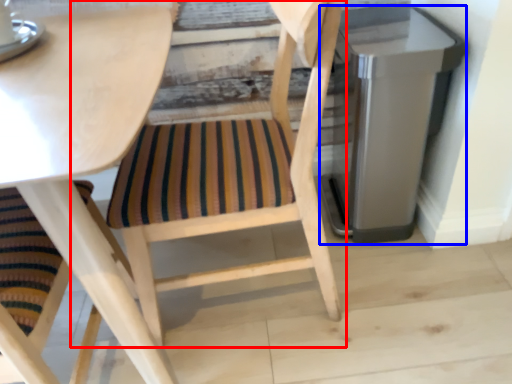
Question: Among these objects, which one is farthest to the camera, chair (highlighted by a red box) or appliance (highlighted by a blue box)?

Choices:
 (A) chair
 (B) appliance

Answer: (B)